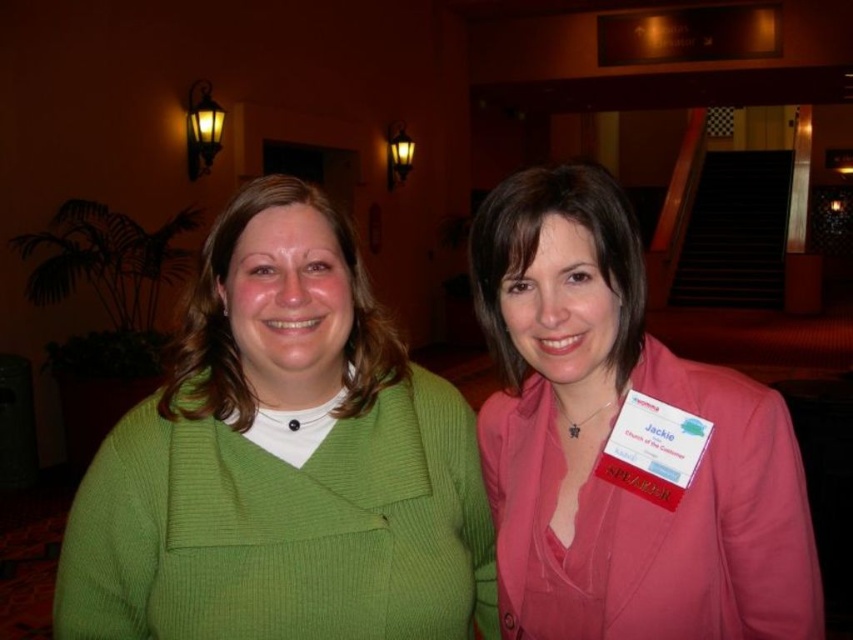
Does green ribbed sweater at center appear under pink satin blazer at center?

Correct, green ribbed sweater at center is located below pink satin blazer at center.

Is green ribbed sweater at center closer to camera compared to pink satin blazer at center?

No, it is behind pink satin blazer at center.

This screenshot has width=853, height=640. What do you see at coordinates (283, 461) in the screenshot?
I see `green ribbed sweater at center` at bounding box center [283, 461].

Image resolution: width=853 pixels, height=640 pixels. I want to click on green ribbed sweater at center, so click(283, 461).